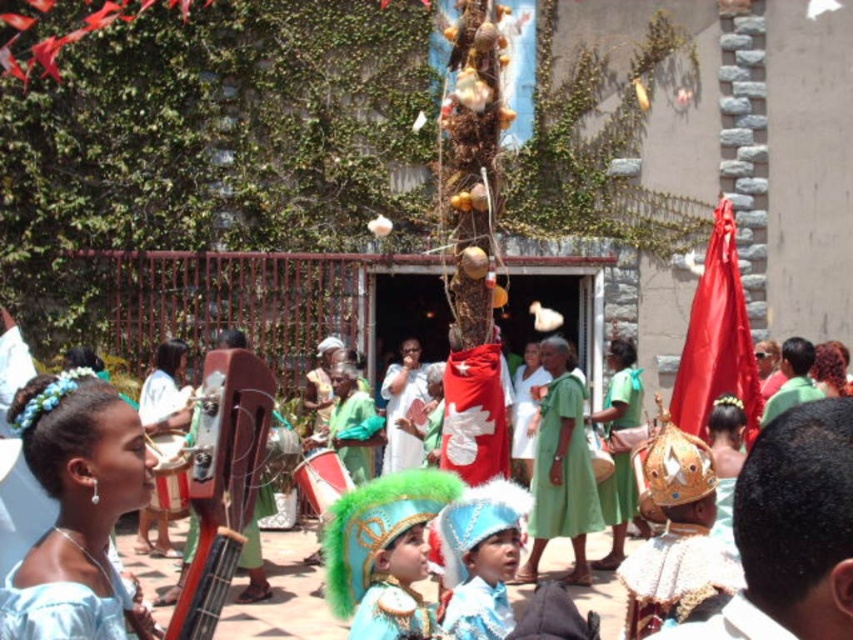
You are a photographer positioned at the back of the courtyard. You want to take a photo of the green cotton dress at center without the light blue satin dress at center blocking it. Is this possible with your current position?

The light blue satin dress at center is in front of the green cotton dress at center, so from your position at the back of the courtyard, the light blue satin dress at center would block the view of the green cotton dress at center. You would need to move to a different position to capture the green cotton dress at center without obstruction.

You are a photographer at the event and want to capture both the light blue satin dress at center and the shiny red drum at center in a single shot. Which object should you focus on first to ensure both are in frame?

The light blue satin dress at center is shorter than the shiny red drum at center, so focusing on the shiny red drum at center first will help ensure both are in frame.